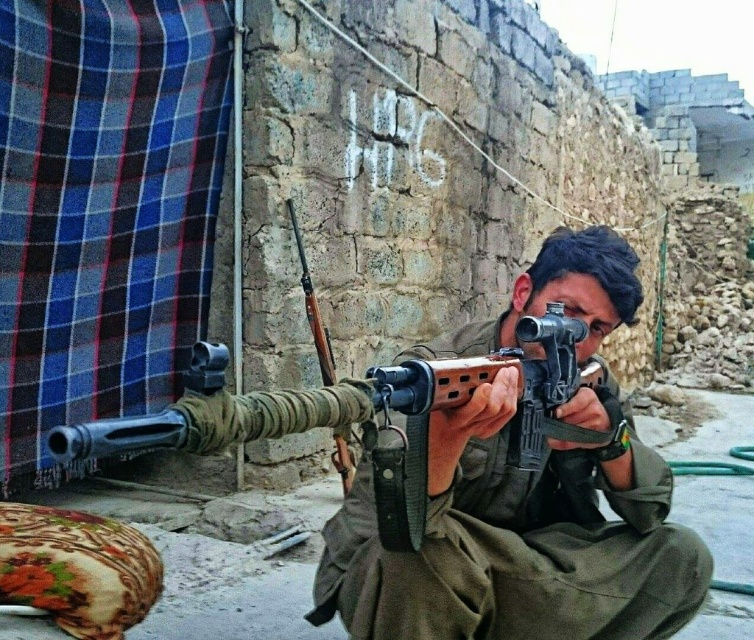
Question: Is the position of matte black rifle at center more distant than that of wooden rifle at center?

Choices:
 (A) yes
 (B) no

Answer: (B)

Question: Which object is closer to the camera taking this photo?

Choices:
 (A) matte black rifle at center
 (B) wooden rifle at center

Answer: (A)

Question: Does matte black rifle at center appear on the right side of wooden rifle at center?

Choices:
 (A) yes
 (B) no

Answer: (A)

Question: Which of the following is the closest to the observer?

Choices:
 (A) wooden rifle at center
 (B) matte black rifle at center

Answer: (B)

Question: Among these objects, which one is nearest to the camera?

Choices:
 (A) wooden rifle at center
 (B) matte black rifle at center

Answer: (B)

Question: Considering the relative positions of matte black rifle at center and wooden rifle at center in the image provided, where is matte black rifle at center located with respect to wooden rifle at center?

Choices:
 (A) above
 (B) below

Answer: (B)